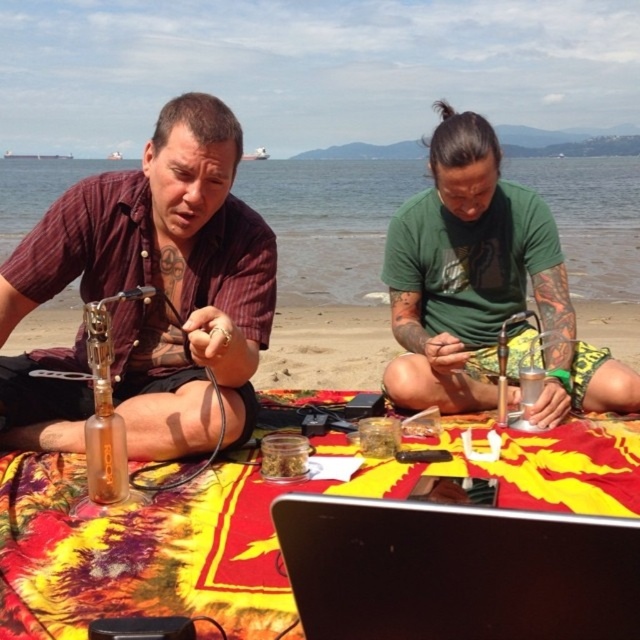
Question: Which object appears closest to the camera in this image?

Choices:
 (A) matte brown shirt at left
 (B) matte glass bottle at left
 (C) black matte laptop at lower center
 (D) tie-dye fabric at center

Answer: (C)

Question: Which point is closer to the camera taking this photo?

Choices:
 (A) (397, 636)
 (B) (513, 333)
 (C) (324, 486)

Answer: (A)

Question: Based on their relative distances, which object is nearer to the green matte shirt at center?

Choices:
 (A) matte brown shirt at left
 (B) tie-dye fabric at center
 (C) black matte laptop at lower center
 (D) matte glass bottle at left

Answer: (B)

Question: Where is matte brown shirt at left located in relation to black matte laptop at lower center in the image?

Choices:
 (A) below
 (B) above

Answer: (B)

Question: Does tie-dye fabric at center lie in front of green matte shirt at center?

Choices:
 (A) yes
 (B) no

Answer: (A)

Question: Is matte brown shirt at left to the left of green matte shirt at center from the viewer's perspective?

Choices:
 (A) yes
 (B) no

Answer: (A)